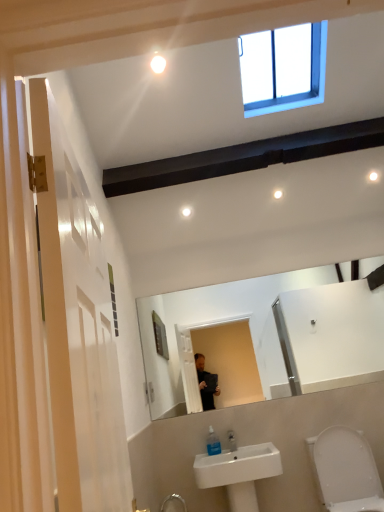
Measure the distance between white ceramic sink at lower center and camera.

2.49 meters.

Locate an element on the screen. The image size is (384, 512). white glossy toilet at lower right is located at coordinates (346, 470).

Which point is more distant from viewer, (201, 479) or (349, 495)?

Point (349, 495)

Can you tell me how much white ceramic sink at lower center and white glossy toilet at lower right differ in facing direction?

0.0294 degrees.

Between white ceramic sink at lower center and white glossy toilet at lower right, which one appears on the right side from the viewer's perspective?

Positioned to the right is white glossy toilet at lower right.

Is the position of white ceramic sink at lower center more distant than that of white glossy toilet at lower right?

Yes, the depth of white ceramic sink at lower center is greater than that of white glossy toilet at lower right.

From a real-world perspective, is clear plastic soap dispenser at lower center positioned above or below white ceramic sink at lower center?

In terms of real-world spatial position, clear plastic soap dispenser at lower center is above white ceramic sink at lower center.

Which of these two, clear plastic soap dispenser at lower center or white ceramic sink at lower center, is wider?

white ceramic sink at lower center.

Is clear plastic soap dispenser at lower center positioned beyond the bounds of white ceramic sink at lower center?

No, clear plastic soap dispenser at lower center is inside or overlapping with white ceramic sink at lower center.

What's the angular difference between clear plastic soap dispenser at lower center and white ceramic sink at lower center's facing directions?

The angle between the facing direction of clear plastic soap dispenser at lower center and the facing direction of white ceramic sink at lower center is 1.21 degrees.

Between white glossy light bulb at upper center and white ceramic sink at lower center, which one has less height?

white glossy light bulb at upper center is shorter.

Between white glossy light bulb at upper center and white ceramic sink at lower center, which one has larger size?

white ceramic sink at lower center.

From the image's perspective, is white glossy light bulb at upper center beneath white ceramic sink at lower center?

Incorrect, from the image's perspective, white glossy light bulb at upper center is higher than white ceramic sink at lower center.

Could white ceramic sink at lower center be considered to be inside white glossy light bulb at upper center?

No, white glossy light bulb at upper center does not contain white ceramic sink at lower center.

Does point (247, 481) come farther from viewer compared to point (154, 61)?

Yes, it is.

From a real-world perspective, is white ceramic sink at lower center positioned above or below white glossy light bulb at upper center?

white ceramic sink at lower center is situated lower than white glossy light bulb at upper center in the real world.

Can you tell me how much white ceramic sink at lower center and white glossy light bulb at upper center differ in facing direction?

The facing directions of white ceramic sink at lower center and white glossy light bulb at upper center are 0.489 degrees apart.

From the image's perspective, is white ceramic sink at lower center located beneath white glossy light bulb at upper center?

Yes.

Considering the positions of objects white ceramic sink at lower center and clear plastic soap dispenser at lower center in the image provided, who is more to the right, white ceramic sink at lower center or clear plastic soap dispenser at lower center?

From the viewer's perspective, white ceramic sink at lower center appears more on the right side.

From the image's perspective, which is above, white ceramic sink at lower center or clear plastic soap dispenser at lower center?

clear plastic soap dispenser at lower center.

Could you tell me if white ceramic sink at lower center is facing clear plastic soap dispenser at lower center?

No, white ceramic sink at lower center is not facing towards clear plastic soap dispenser at lower center.

Considering the relative sizes of white ceramic sink at lower center and clear plastic soap dispenser at lower center in the image provided, is white ceramic sink at lower center bigger than clear plastic soap dispenser at lower center?

Indeed, white ceramic sink at lower center has a larger size compared to clear plastic soap dispenser at lower center.

Are white glossy light bulb at upper center and clear plastic soap dispenser at lower center beside each other?

No, white glossy light bulb at upper center is not with clear plastic soap dispenser at lower center.

Considering the sizes of white glossy light bulb at upper center and clear plastic soap dispenser at lower center in the image, is white glossy light bulb at upper center taller or shorter than clear plastic soap dispenser at lower center?

Considering their sizes, white glossy light bulb at upper center has less height than clear plastic soap dispenser at lower center.

From a real-world perspective, is white glossy light bulb at upper center positioned under clear plastic soap dispenser at lower center based on gravity?

Incorrect, from a real-world perspective, white glossy light bulb at upper center is higher than clear plastic soap dispenser at lower center.

Which is correct: white glossy light bulb at upper center is inside clear plastic soap dispenser at lower center, or outside of it?

white glossy light bulb at upper center exists outside the volume of clear plastic soap dispenser at lower center.

Is white glossy toilet at lower right positioned far away from white glossy light bulb at upper center?

That's right, there is a large distance between white glossy toilet at lower right and white glossy light bulb at upper center.

Considering the positions of objects white glossy toilet at lower right and white glossy light bulb at upper center in the image provided, who is more to the left, white glossy toilet at lower right or white glossy light bulb at upper center?

white glossy light bulb at upper center.

Looking at their sizes, would you say white glossy toilet at lower right is wider or thinner than white glossy light bulb at upper center?

white glossy toilet at lower right is wider than white glossy light bulb at upper center.

Is point (334, 499) behind point (160, 56)?

Yes, point (334, 499) is farther from viewer.

I want to click on sink below the white glossy toilet at lower right (from the image's perspective), so click(x=239, y=472).

Identify the location of sink on the right side of clear plastic soap dispenser at lower center. (239, 472).

Which object lies further to the anchor point clear plastic soap dispenser at lower center, white ceramic sink at lower center or white glossy toilet at lower right?

white glossy toilet at lower right is positioned further to the anchor clear plastic soap dispenser at lower center.

Looking at the image, which one is located closer to white glossy toilet at lower right, white glossy light bulb at upper center or clear plastic soap dispenser at lower center?

clear plastic soap dispenser at lower center is closer to white glossy toilet at lower right.

When comparing their distances from white glossy light bulb at upper center, does clear plastic soap dispenser at lower center or white glossy toilet at lower right seem closer?

clear plastic soap dispenser at lower center is closer to white glossy light bulb at upper center.

Which object lies nearer to the anchor point clear plastic soap dispenser at lower center, white glossy toilet at lower right or white glossy light bulb at upper center?

white glossy toilet at lower right is positioned closer to the anchor clear plastic soap dispenser at lower center.

From the image, which object appears to be nearer to white ceramic sink at lower center, white glossy light bulb at upper center or white glossy toilet at lower right?

white glossy toilet at lower right is closer to white ceramic sink at lower center.

Based on their spatial positions, is white glossy light bulb at upper center or clear plastic soap dispenser at lower center further from white ceramic sink at lower center?

white glossy light bulb at upper center is further to white ceramic sink at lower center.

From the image, which object appears to be farther from clear plastic soap dispenser at lower center, white glossy light bulb at upper center or white ceramic sink at lower center?

white glossy light bulb at upper center.

From the image, which object appears to be farther from white ceramic sink at lower center, white glossy toilet at lower right or white glossy light bulb at upper center?

Among the two, white glossy light bulb at upper center is located further to white ceramic sink at lower center.

Identify the location of sink between clear plastic soap dispenser at lower center and white glossy toilet at lower right in the horizontal direction. The height and width of the screenshot is (512, 384). (239, 472).

At what (x,y) coordinates should I click in order to perform the action: click on soap dispenser between white glossy light bulb at upper center and white ceramic sink at lower center in the vertical direction. Please return your answer as a coordinate pair (x, y). This screenshot has width=384, height=512. Looking at the image, I should click on (213, 443).

Find the location of a particular element. The width and height of the screenshot is (384, 512). toilet between white glossy light bulb at upper center and white ceramic sink at lower center vertically is located at coordinates (346, 470).

Find the location of a particular element. The width and height of the screenshot is (384, 512). soap dispenser between white glossy light bulb at upper center and white glossy toilet at lower right vertically is located at coordinates (213, 443).